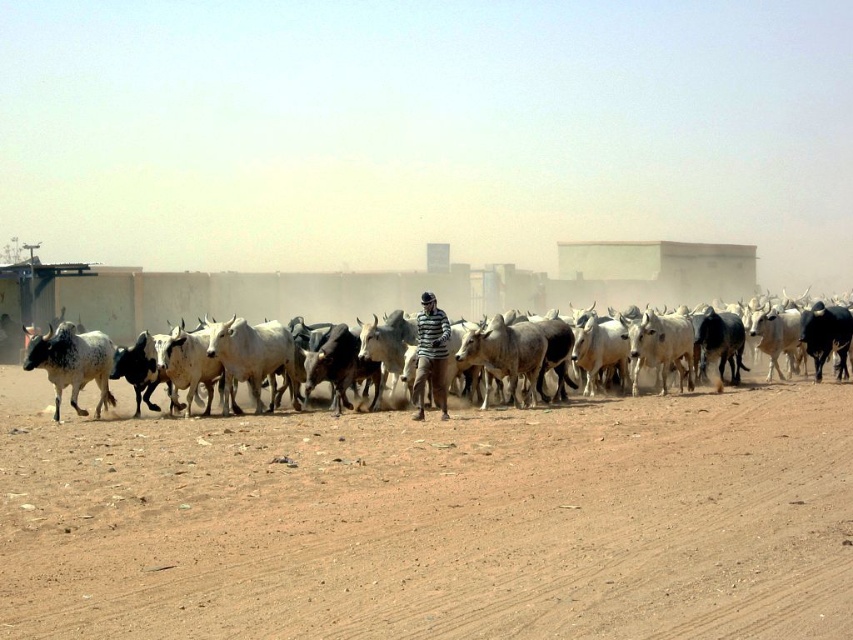
Does brown sandy dirt at center appear on the left side of striped shirt at center?

In fact, brown sandy dirt at center is to the right of striped shirt at center.

Who is lower down, brown sandy dirt at center or striped shirt at center?

brown sandy dirt at center is lower down.

Which is in front, point (769, 586) or point (436, 365)?

Point (769, 586) is more forward.

Locate an element on the screen. The image size is (853, 640). brown sandy dirt at center is located at coordinates (433, 522).

Can you confirm if speckled white cow at left is positioned to the right of striped shirt at center?

No, speckled white cow at left is not to the right of striped shirt at center.

Which is in front, point (108, 346) or point (421, 339)?

Point (421, 339)

The height and width of the screenshot is (640, 853). What are the coordinates of `speckled white cow at left` in the screenshot? It's located at (73, 364).

Between brown sandy dirt at center and speckled white cows at center, which one appears on the right side from the viewer's perspective?

brown sandy dirt at center is more to the right.

Which of these two, brown sandy dirt at center or speckled white cows at center, stands taller?

speckled white cows at center is taller.

Who is more forward, (x=264, y=627) or (x=242, y=333)?

Point (x=264, y=627)

This screenshot has width=853, height=640. I want to click on brown sandy dirt at center, so click(433, 522).